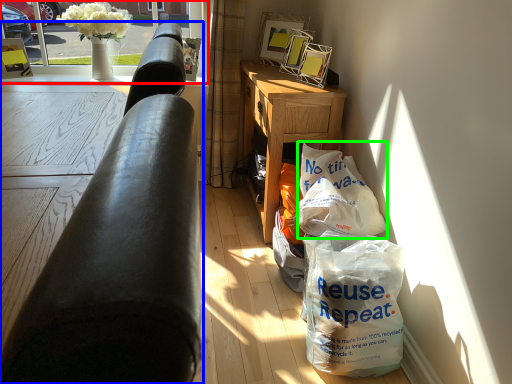
Question: Which object is the farthest from window screen (highlighted by a red box)? Choose among these: studio couch (highlighted by a blue box) or grocery bag (highlighted by a green box).

Choices:
 (A) studio couch
 (B) grocery bag

Answer: (A)